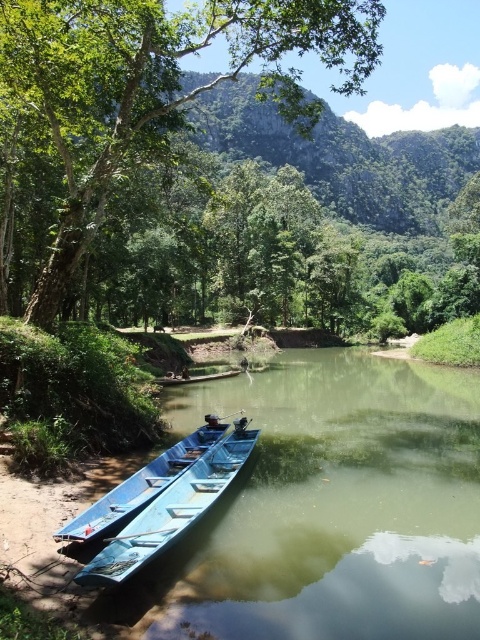
Question: Does green leafy tree at center have a lesser width compared to blue wooden boat at lower left?

Choices:
 (A) no
 (B) yes

Answer: (A)

Question: Does green leafy tree at center appear on the left side of blue wooden boat at lower left?

Choices:
 (A) no
 (B) yes

Answer: (A)

Question: Which point is farther from the camera taking this photo?

Choices:
 (A) (115, 541)
 (B) (96, 72)

Answer: (B)

Question: Which point appears farthest from the camera in this image?

Choices:
 (A) 200,483
 (B) 14,42

Answer: (B)

Question: Is the position of green leafy tree at center more distant than that of blue wooden boat at lower left?

Choices:
 (A) yes
 (B) no

Answer: (A)